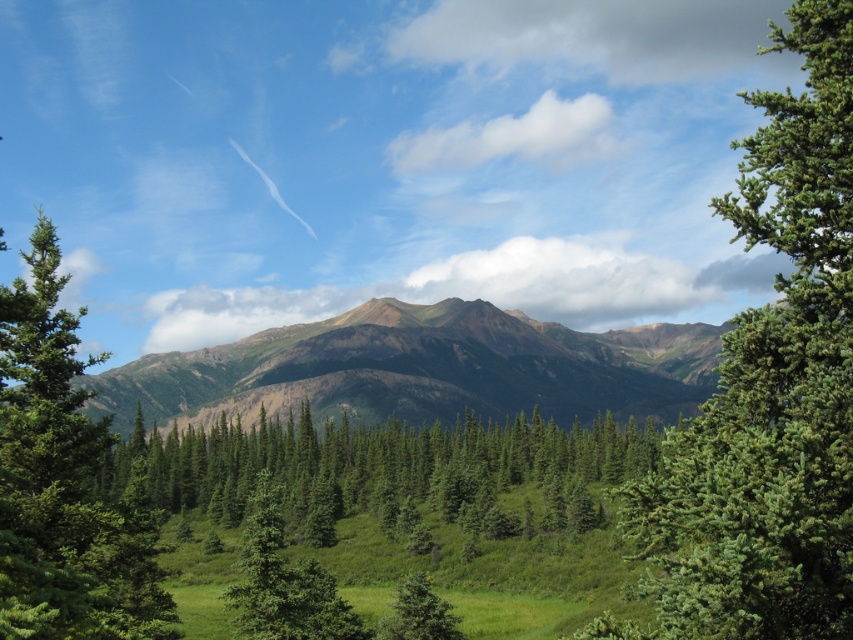
You are a hiker standing in the meadow and looking towards the mountains. Which object, the rustic brown mountain range at center or the green matte tree at center, is higher in the scene?

The rustic brown mountain range at center is located above the green matte tree at center, so the mountain range is higher in the scene.

You are standing in the meadow and want to take a photo of the rustic brown mountain range at center and the green matte tree at left. Which object should you frame first in your camera viewfinder to ensure both are in the shot?

You should frame the green matte tree at left first because the rustic brown mountain range at center is positioned to its right, so starting with the tree ensures the mountain range will also be captured in the frame.

You are a hiker standing on the meadow looking at the green matte tree at left and the rustic brown mountain range at center. Which object is farther away from you?

The green matte tree at left is farther away because it is positioned behind the rustic brown mountain range at center, indicating greater distance from the observer.